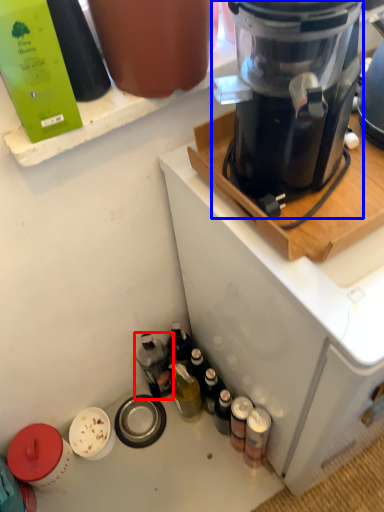
Question: Which of the following is the closest to the observer, bottle (highlighted by a red box) or blender (highlighted by a blue box)?

Choices:
 (A) bottle
 (B) blender

Answer: (B)